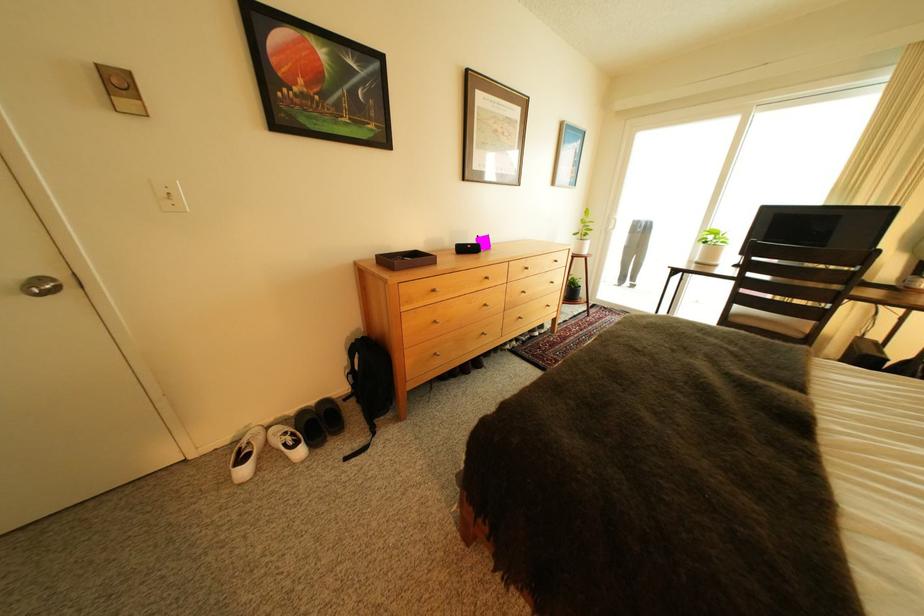
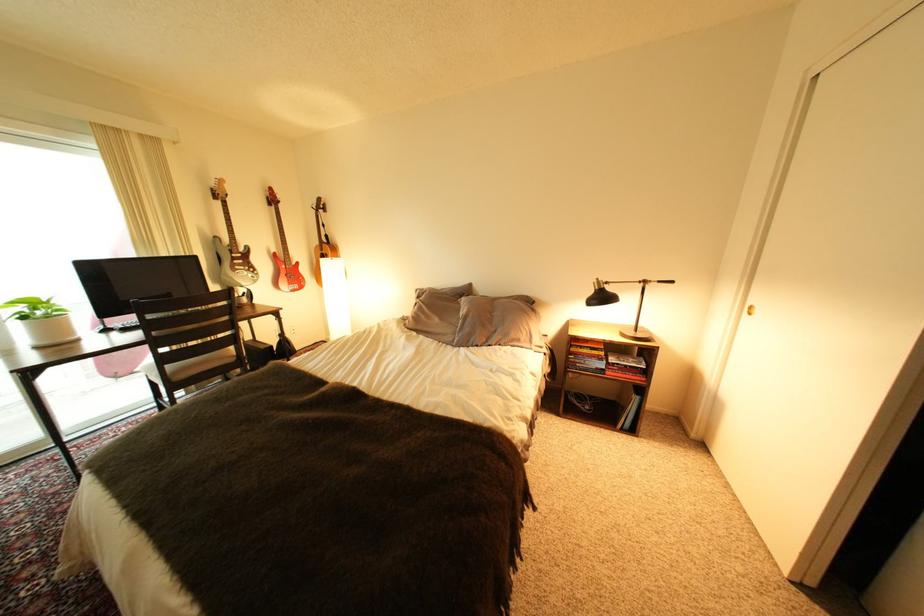
The images are taken continuously from a first-person perspective. In which direction is your viewpoint rotating?

The camera rotated toward right-down.